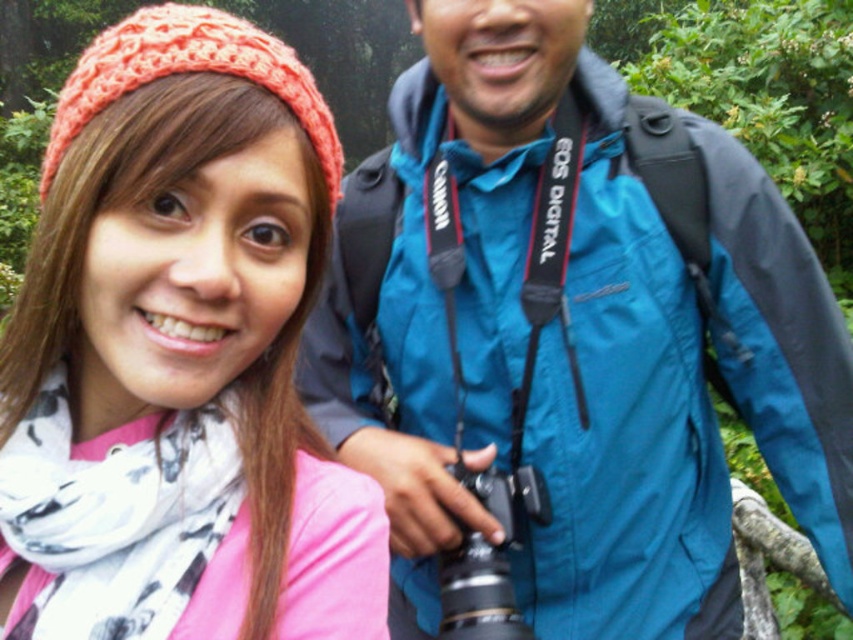
Question: Which object appears farthest from the camera in this image?

Choices:
 (A) black plastic camera at center
 (B) pink fabric scarf at center

Answer: (A)

Question: Can you confirm if pink fabric scarf at center is positioned below black plastic camera at center?

Choices:
 (A) no
 (B) yes

Answer: (A)

Question: Is pink fabric scarf at center to the right of black plastic camera at center from the viewer's perspective?

Choices:
 (A) yes
 (B) no

Answer: (B)

Question: Which point is closer to the camera?

Choices:
 (A) black plastic camera at center
 (B) pink fabric scarf at center

Answer: (B)

Question: Can you confirm if pink fabric scarf at center is thinner than black plastic camera at center?

Choices:
 (A) no
 (B) yes

Answer: (A)